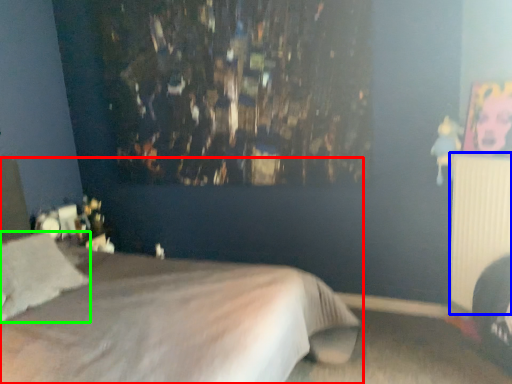
Question: Based on their relative distances, which object is nearer to bed (highlighted by a red box)? Choose from radiator (highlighted by a blue box) and pillow (highlighted by a green box).

Choices:
 (A) radiator
 (B) pillow

Answer: (B)